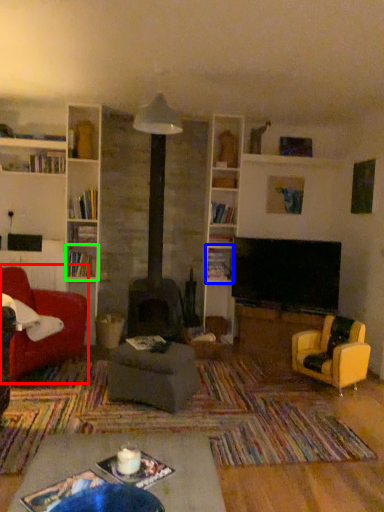
Question: Which object is positioned farthest from chair (highlighted by a red box)? Select from shelf (highlighted by a blue box) and shelf (highlighted by a green box).

Choices:
 (A) shelf
 (B) shelf

Answer: (A)